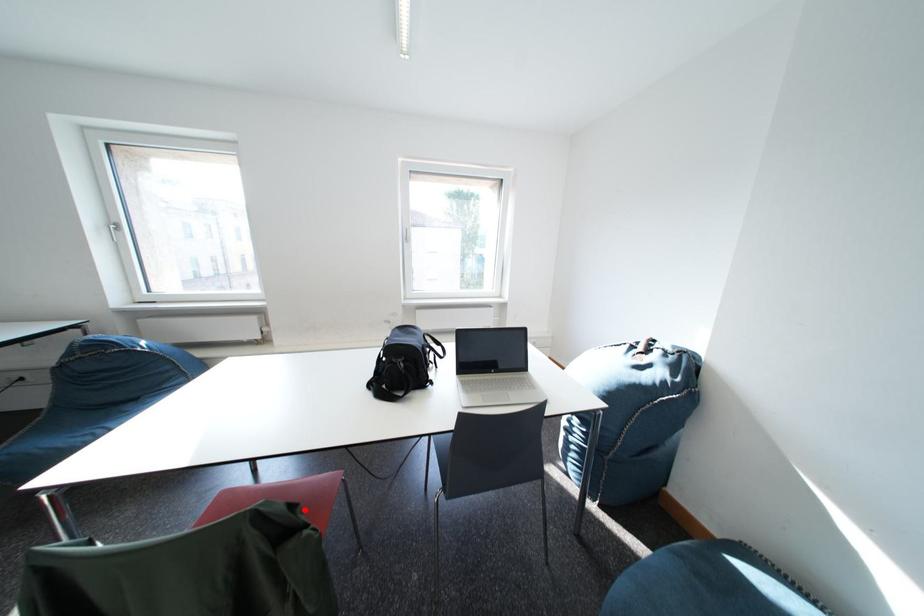
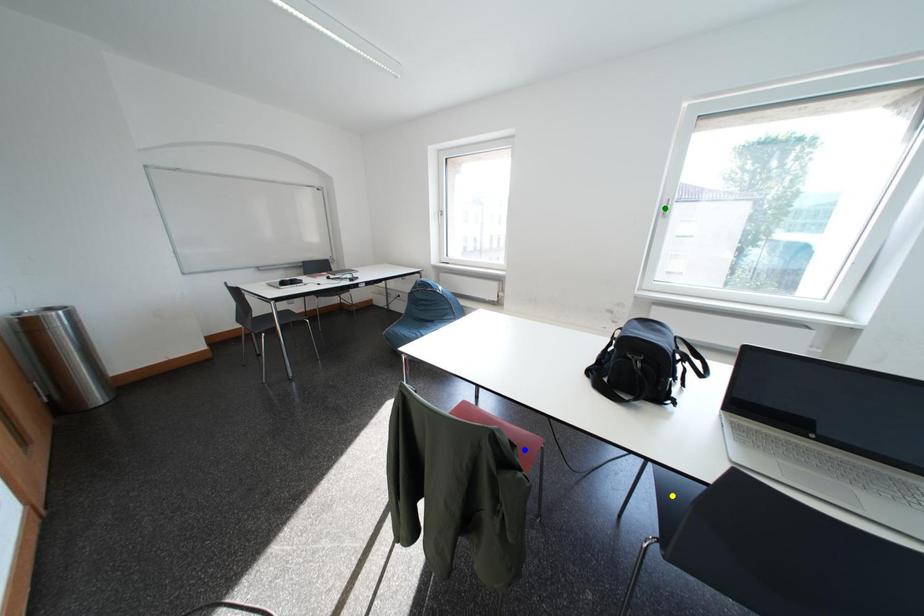
Question: I am providing you with two images of the same scene from different viewpoints. A red point is marked on the first image. You are given multiple points on the second image. Which point in image 2 is actually the same real-world point as the red point in image 1?

Choices:
 (A) green point
 (B) blue point
 (C) yellow point

Answer: (B)